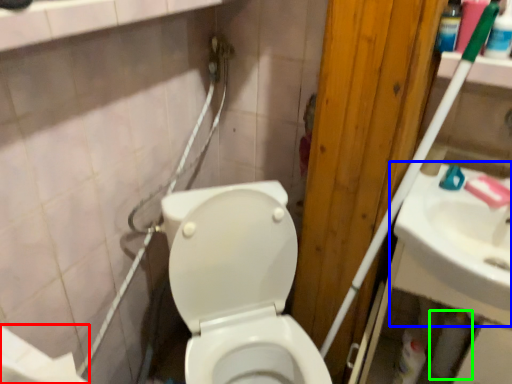
Question: Considering the real-world distances, which object is closest to toilet paper (highlighted by a red box)? sink (highlighted by a blue box) or toilet paper (highlighted by a green box).

Choices:
 (A) sink
 (B) toilet paper

Answer: (A)